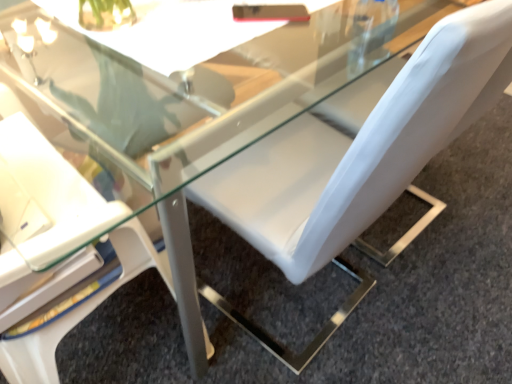
Image resolution: width=512 pixels, height=384 pixels. What do you see at coordinates (54, 246) in the screenshot?
I see `white leather chair at upper right, the first chair from the left` at bounding box center [54, 246].

You are a GUI agent. You are given a task and a screenshot of the screen. Output one action in this format:
    pyautogui.click(x=<x>, y=<y>)
    Task: Click on the white leather chair at upper right, which appears as the 2th chair when viewed from the right
    
    Given the screenshot: What is the action you would take?
    pyautogui.click(x=54, y=246)

This screenshot has height=384, width=512. What do you see at coordinates (345, 158) in the screenshot?
I see `white leather chair at center, the 2th chair when ordered from left to right` at bounding box center [345, 158].

Identify the location of white leather chair at center, acting as the 1th chair starting from the right. click(345, 158).

Locate an element on the screen. This screenshot has width=512, height=384. white leather chair at upper right, the first chair from the left is located at coordinates (54, 246).

Is white leather chair at center, the 2th chair when ordered from left to right, to the left of white leather chair at upper right, which appears as the 2th chair when viewed from the right, from the viewer's perspective?

In fact, white leather chair at center, the 2th chair when ordered from left to right, is to the right of white leather chair at upper right, which appears as the 2th chair when viewed from the right.

Is white leather chair at center, acting as the 1th chair starting from the right, closer to camera compared to white leather chair at upper right, the first chair from the left?

No, it is not.

Which is behind, point (252, 225) or point (42, 166)?

Point (252, 225)

From the image's perspective, would you say white leather chair at center, the 2th chair when ordered from left to right, is positioned over white leather chair at upper right, the first chair from the left?

Yes, from the image's perspective, white leather chair at center, the 2th chair when ordered from left to right, is over white leather chair at upper right, the first chair from the left.

From a real-world perspective, which object rests below the other?

white leather chair at upper right, which appears as the 2th chair when viewed from the right, is physically lower.

Is white leather chair at center, acting as the 1th chair starting from the right, wider than white leather chair at upper right, the first chair from the left?

Yes, white leather chair at center, acting as the 1th chair starting from the right, is wider than white leather chair at upper right, the first chair from the left.

From the picture: In terms of height, does white leather chair at center, acting as the 1th chair starting from the right, look taller or shorter compared to white leather chair at upper right, the first chair from the left?

In the image, white leather chair at center, acting as the 1th chair starting from the right, appears to be taller than white leather chair at upper right, the first chair from the left.

Between white leather chair at center, acting as the 1th chair starting from the right, and white leather chair at upper right, the first chair from the left, which one has smaller size?

Smaller between the two is white leather chair at upper right, the first chair from the left.

Could white leather chair at upper right, the first chair from the left, be considered to be inside white leather chair at center, acting as the 1th chair starting from the right?

No, white leather chair at upper right, the first chair from the left, is not inside white leather chair at center, acting as the 1th chair starting from the right.

Is white leather chair at center, the 2th chair when ordered from left to right, far away from white leather chair at upper right, the first chair from the left?

No, there isn't a large distance between white leather chair at center, the 2th chair when ordered from left to right, and white leather chair at upper right, the first chair from the left.

Is white leather chair at center, the 2th chair when ordered from left to right, turned away from white leather chair at upper right, which appears as the 2th chair when viewed from the right?

white leather chair at center, the 2th chair when ordered from left to right, does not have its back to white leather chair at upper right, which appears as the 2th chair when viewed from the right.

Can you tell me how much white leather chair at center, the 2th chair when ordered from left to right, and white leather chair at upper right, which appears as the 2th chair when viewed from the right, differ in facing direction?

The angle between the facing direction of white leather chair at center, the 2th chair when ordered from left to right, and the facing direction of white leather chair at upper right, which appears as the 2th chair when viewed from the right, is 93.3 degrees.

At what (x,y) coordinates should I click in order to perform the action: click on chair on the right side of white leather chair at upper right, the first chair from the left. Please return your answer as a coordinate pair (x, y). Image resolution: width=512 pixels, height=384 pixels. Looking at the image, I should click on (345, 158).

Based on their positions, is white leather chair at upper right, the first chair from the left, located to the left or right of white leather chair at center, the 2th chair when ordered from left to right?

From the image, it's evident that white leather chair at upper right, the first chair from the left, is to the left of white leather chair at center, the 2th chair when ordered from left to right.

Considering the positions of objects white leather chair at upper right, which appears as the 2th chair when viewed from the right, and white leather chair at center, the 2th chair when ordered from left to right, in the image provided, who is behind, white leather chair at upper right, which appears as the 2th chair when viewed from the right, or white leather chair at center, the 2th chair when ordered from left to right,?

white leather chair at center, the 2th chair when ordered from left to right, is behind.

Consider the image. Which is further, (44, 206) or (324, 147)?

Positioned behind is point (324, 147).

Based on the photo, from the image's perspective, is white leather chair at upper right, which appears as the 2th chair when viewed from the right, above or below white leather chair at center, acting as the 1th chair starting from the right?

Clearly, from the image's perspective, white leather chair at upper right, which appears as the 2th chair when viewed from the right, is below white leather chair at center, acting as the 1th chair starting from the right.

From a real-world perspective, which is physically above, white leather chair at upper right, which appears as the 2th chair when viewed from the right, or white leather chair at center, acting as the 1th chair starting from the right?

white leather chair at center, acting as the 1th chair starting from the right, is physically above.

Which object is wider, white leather chair at upper right, the first chair from the left, or white leather chair at center, acting as the 1th chair starting from the right?

white leather chair at center, acting as the 1th chair starting from the right, is wider.

Between white leather chair at upper right, which appears as the 2th chair when viewed from the right, and white leather chair at center, the 2th chair when ordered from left to right, which one has more height?

white leather chair at center, the 2th chair when ordered from left to right, is taller.

Considering the sizes of objects white leather chair at upper right, which appears as the 2th chair when viewed from the right, and white leather chair at center, the 2th chair when ordered from left to right, in the image provided, who is smaller, white leather chair at upper right, which appears as the 2th chair when viewed from the right, or white leather chair at center, the 2th chair when ordered from left to right,?

white leather chair at upper right, which appears as the 2th chair when viewed from the right, is smaller.

Is white leather chair at upper right, the first chair from the left, spatially inside white leather chair at center, the 2th chair when ordered from left to right, or outside of it?

white leather chair at upper right, the first chair from the left, is located beyond the bounds of white leather chair at center, the 2th chair when ordered from left to right.

Is white leather chair at upper right, which appears as the 2th chair when viewed from the right, directly adjacent to white leather chair at center, acting as the 1th chair starting from the right?

white leather chair at upper right, which appears as the 2th chair when viewed from the right, is not next to white leather chair at center, acting as the 1th chair starting from the right, and they're not touching.

Is white leather chair at upper right, which appears as the 2th chair when viewed from the right, oriented away from white leather chair at center, acting as the 1th chair starting from the right?

No, white leather chair at upper right, which appears as the 2th chair when viewed from the right, is not facing the opposite direction of white leather chair at center, acting as the 1th chair starting from the right.

You are a GUI agent. You are given a task and a screenshot of the screen. Output one action in this format:
    pyautogui.click(x=<x>, y=<y>)
    Task: Click on the chair on the left of white leather chair at center, the 2th chair when ordered from left to right
    This screenshot has width=512, height=384.
    Given the screenshot: What is the action you would take?
    pyautogui.click(x=54, y=246)

Where is `chair lying on the left of white leather chair at center, the 2th chair when ordered from left to right`? This screenshot has height=384, width=512. chair lying on the left of white leather chair at center, the 2th chair when ordered from left to right is located at coordinates (54, 246).

Locate an element on the screen. This screenshot has height=384, width=512. chair above the white leather chair at upper right, which appears as the 2th chair when viewed from the right (from a real-world perspective) is located at coordinates (345, 158).